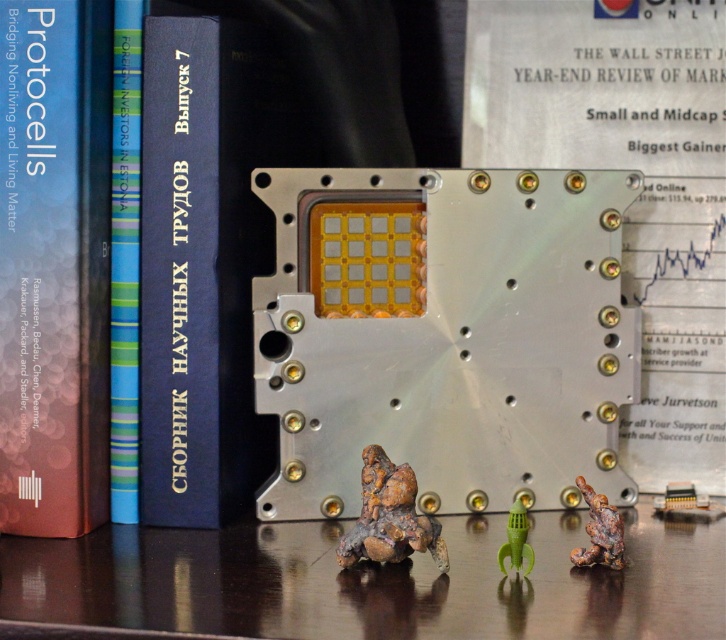
Question: Which point is farther to the camera?

Choices:
 (A) (526, 582)
 (B) (70, 150)

Answer: (B)

Question: Does blue striped paper at left have a greater width compared to rusty metal figure at lower right?

Choices:
 (A) no
 (B) yes

Answer: (A)

Question: Among these points, which one is nearest to the camera?

Choices:
 (A) (521, 522)
 (B) (122, 230)
 (C) (99, 189)

Answer: (A)

Question: Does blue hardcover book at center have a lesser width compared to rusty metal rock at center?

Choices:
 (A) yes
 (B) no

Answer: (A)

Question: Does blue hardcover book at center appear over rusty metal rock at center?

Choices:
 (A) yes
 (B) no

Answer: (A)

Question: Which object appears closest to the camera in this image?

Choices:
 (A) rusty metal rock at center
 (B) green matte rocket at center

Answer: (A)